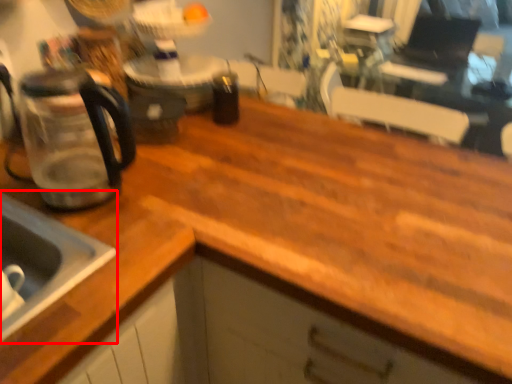
Question: Where is sink (annotated by the red box) located in relation to coffeepot in the image?

Choices:
 (A) left
 (B) right

Answer: (A)